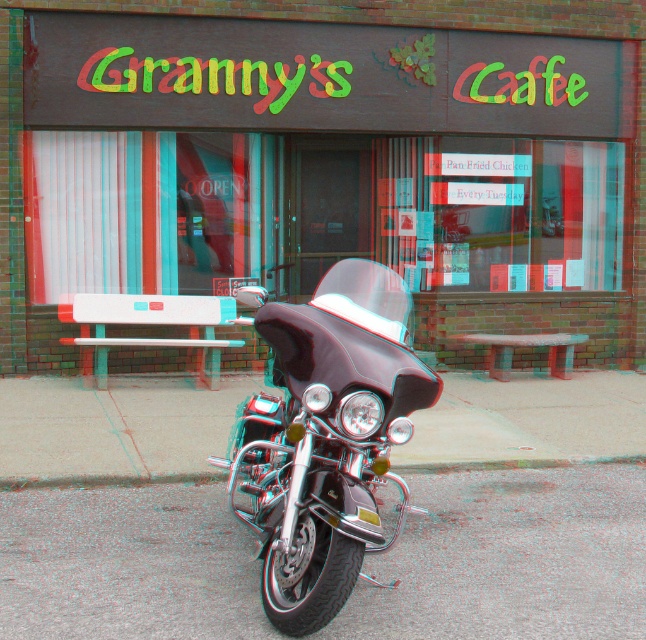
Between brick wall at center and shiny chrome motorbike at center, which one has more height?

With more height is shiny chrome motorbike at center.

Is brick wall at center wider than shiny chrome motorbike at center?

Incorrect, brick wall at center's width does not surpass shiny chrome motorbike at center's.

Image resolution: width=646 pixels, height=640 pixels. Describe the element at coordinates (328, 161) in the screenshot. I see `brick wall at center` at that location.

Locate an element on the screen. brick wall at center is located at coordinates (328, 161).